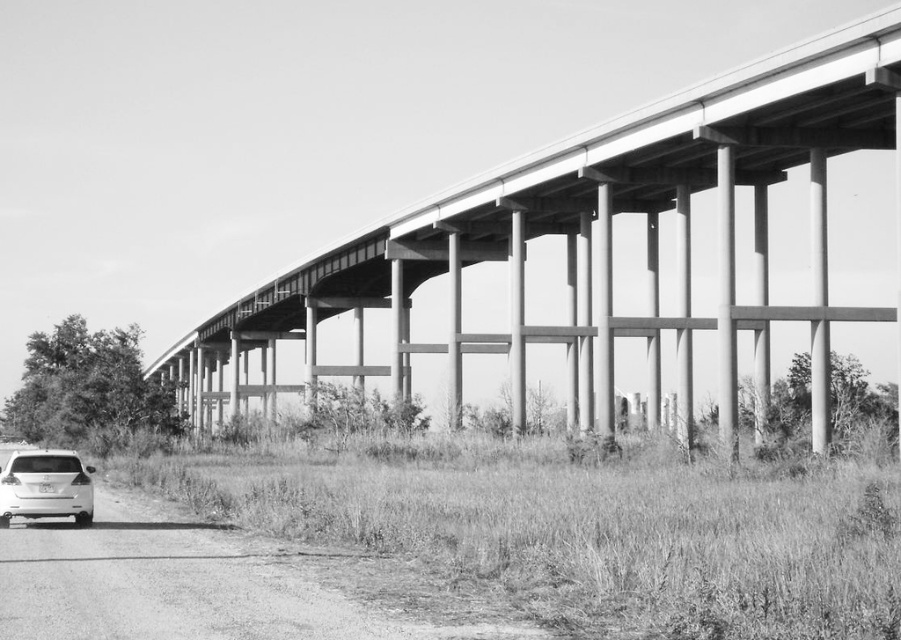
Can you confirm if concrete bridge at center is bigger than white matte car at lower left?

Correct, concrete bridge at center is larger in size than white matte car at lower left.

Is concrete bridge at center wider than white matte car at lower left?

Yes, concrete bridge at center is wider than white matte car at lower left.

This screenshot has width=901, height=640. Find the location of `concrete bridge at center`. concrete bridge at center is located at coordinates (590, 244).

You are a GUI agent. You are given a task and a screenshot of the screen. Output one action in this format:
    pyautogui.click(x=<x>, y=<y>)
    Task: Click on the concrete bridge at center
    The image size is (901, 640).
    Given the screenshot: What is the action you would take?
    pyautogui.click(x=590, y=244)